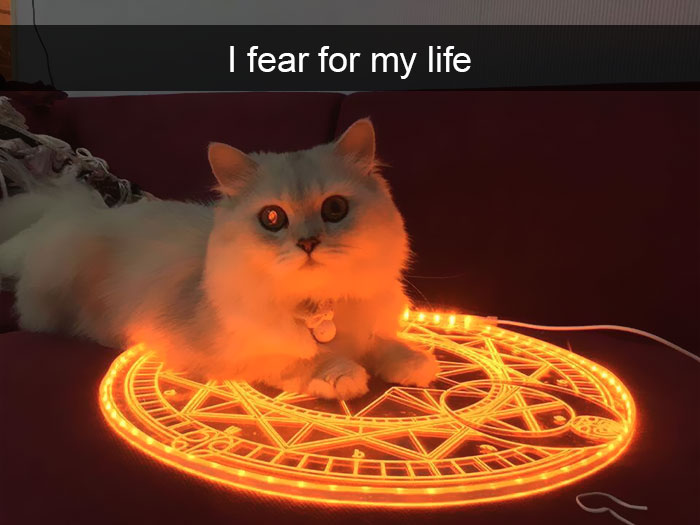
In order to click on surface cat lays on in this screenshot , I will do `click(55, 360)`.